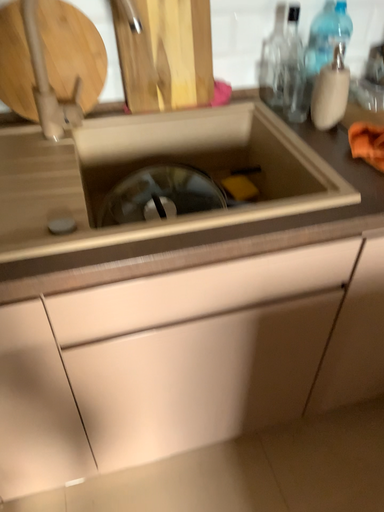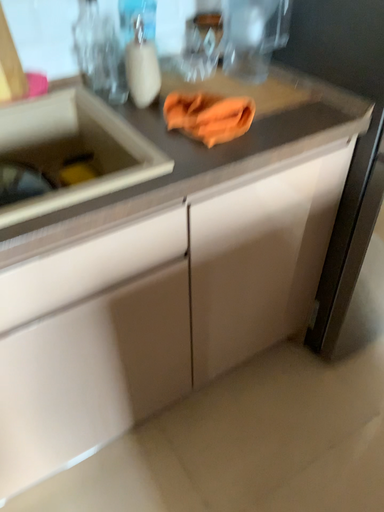
Question: How did the camera likely rotate when shooting the video?

Choices:
 (A) rotated right
 (B) rotated left

Answer: (A)